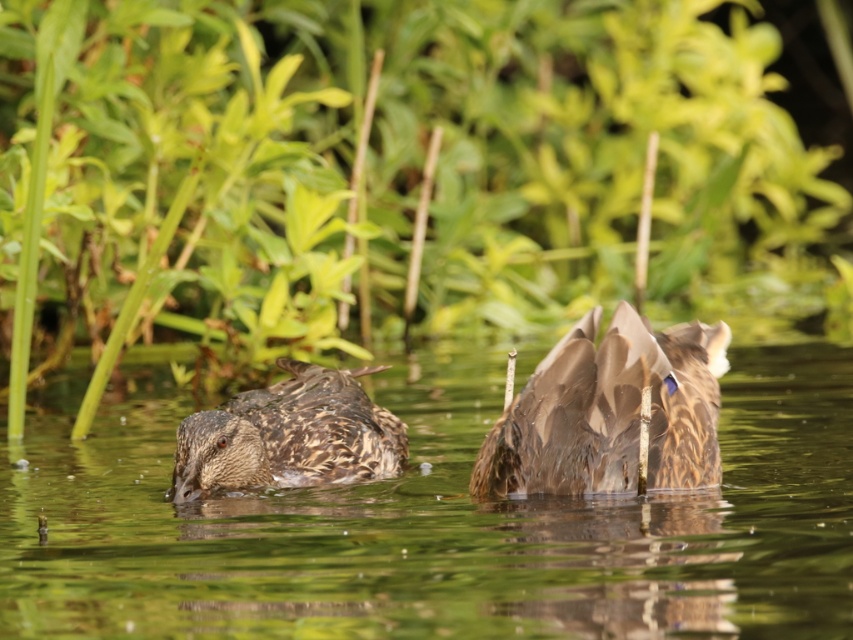
Question: Based on their relative distances, which object is nearer to the green leafy plant at center?

Choices:
 (A) brown feathered duck at center
 (B) brown speckled feathers at center

Answer: (A)

Question: Can you confirm if brown feathered duck at center is positioned to the left of brown feathered duck at left?

Choices:
 (A) yes
 (B) no

Answer: (B)

Question: Which point is farther to the camera?

Choices:
 (A) brown feathered duck at center
 (B) brown feathered duck at left

Answer: (B)

Question: Does green leafy plant at center appear on the left side of brown speckled feathers at center?

Choices:
 (A) yes
 (B) no

Answer: (A)

Question: Which object appears closest to the camera in this image?

Choices:
 (A) brown feathered duck at center
 (B) brown feathered duck at left

Answer: (A)

Question: Is green leafy plant at center below brown speckled feathers at center?

Choices:
 (A) no
 (B) yes

Answer: (A)